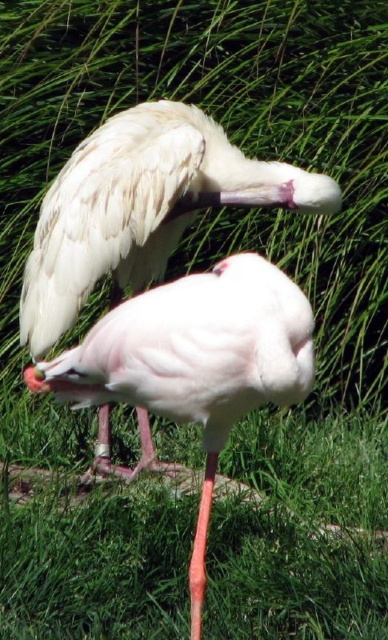
You are standing in front of the image of two flamingos. There is a point at coordinates point (105, 164). If you want to touch this point with a 10 foot long stick, will the stick reach it?

The distance of point (105, 164) from viewer is 10.72 feet, so the 10 foot long stick is too short to reach it.

Based on the photo, you are a birdwatcher observing two flamingos in a grassy area. You see the smooth white bird at center and the smooth pink flamingo at center. Which of these two birds is taller?

The smooth pink flamingo at center is taller than the smooth white bird at center.

You are a birdwatcher observing two flamingos in a grassy area. You see the smooth white bird at center and the smooth pink flamingo at center. Which one is positioned more to the left?

The smooth white bird at center is positioned more to the left than the smooth pink flamingo at center.